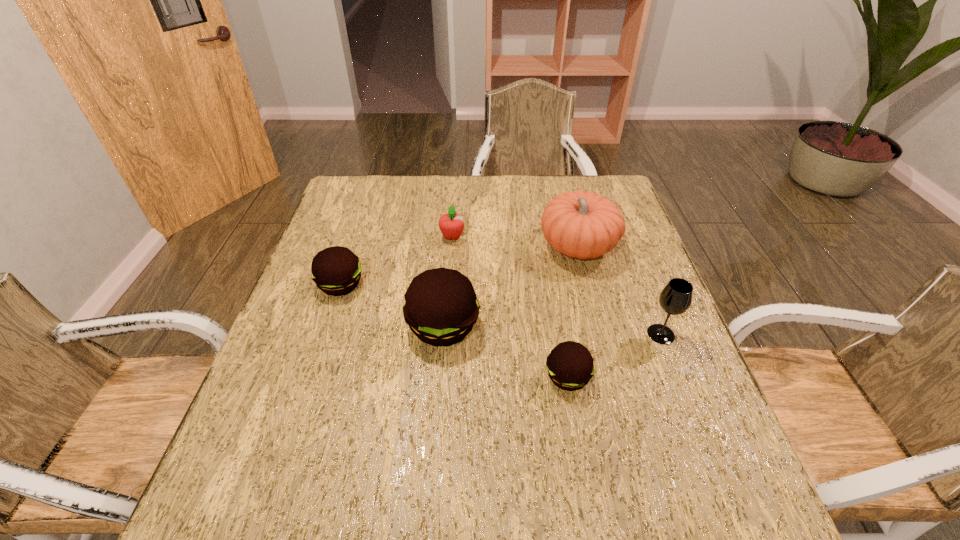
Locate an element on the screen. The width and height of the screenshot is (960, 540). free spot between the pumpkin and the second shortest patty is located at coordinates [459, 266].

The image size is (960, 540). Identify the location of vacant space that is in between the wineglass and the pumpkin. (619, 291).

Where is `free space between the leftmost patty and the apple`? free space between the leftmost patty and the apple is located at coordinates (396, 260).

Image resolution: width=960 pixels, height=540 pixels. In order to click on object identified as the second closest to the tallest patty in this screenshot , I will do 570,366.

Identify which object is located as the nearest to the leftmost object. Please provide its 2D coordinates. Your answer should be formatted as a tuple, i.e. [(x, y)], where the tuple contains the x and y coordinates of a point satisfying the conditions above.

[(441, 307)]

At what (x,y) coordinates should I click in order to perform the action: click on patty that is the nearest to the wineglass. Please return your answer as a coordinate pair (x, y). Looking at the image, I should click on tap(570, 366).

Identify the location of patty that is the second closest to the tallest patty. 570,366.

The height and width of the screenshot is (540, 960). Find the location of `free space in the image that satisfies the following two spatial constraints: 1. on the back side of the pumpkin; 2. on the left side of the tallest patty`. free space in the image that satisfies the following two spatial constraints: 1. on the back side of the pumpkin; 2. on the left side of the tallest patty is located at coordinates coord(449,247).

Locate an element on the screen. Image resolution: width=960 pixels, height=540 pixels. free space that satisfies the following two spatial constraints: 1. on the front side of the wineglass; 2. on the left side of the second tallest patty is located at coordinates (324, 334).